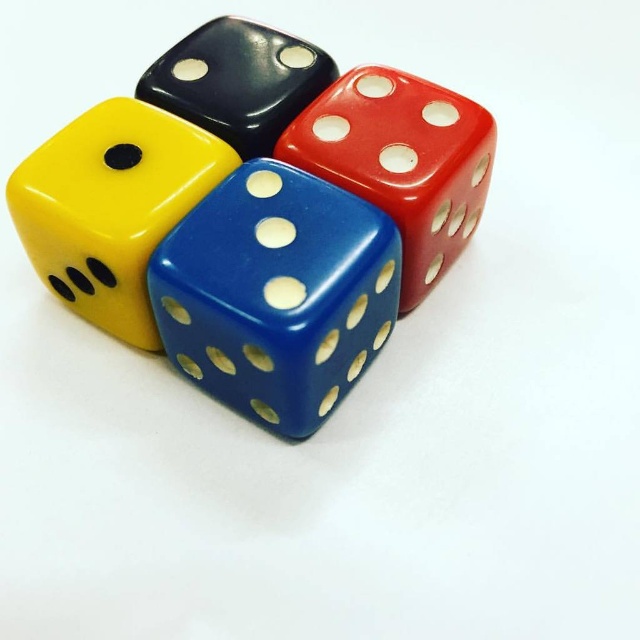
Can you confirm if red glossy dice at center is bigger than black glossy dice at upper center?

Correct, red glossy dice at center is larger in size than black glossy dice at upper center.

Which of these two, red glossy dice at center or black glossy dice at upper center, stands taller?

red glossy dice at center

Is point (449, 252) farther from viewer compared to point (209, 100)?

Yes, point (449, 252) is farther from viewer.

Find the location of a particular element. red glossy dice at center is located at coordinates (401, 161).

In the scene shown: Is yellow glossy dice at center below red glossy dice at center?

Indeed, yellow glossy dice at center is positioned under red glossy dice at center.

Between yellow glossy dice at center and red glossy dice at center, which one has more height?

red glossy dice at center is taller.

Does point (154, 147) come behind point (429, 108)?

That is False.

Identify the location of yellow glossy dice at center. (112, 208).

Which of these two, glossy plastic dice at center or yellow glossy dice at center, stands taller?

glossy plastic dice at center is taller.

Does point (205, 289) lie behind point (132, 227)?

No, (205, 289) is closer to viewer.

Does point (268, 417) come in front of point (157, 236)?

No, (268, 417) is further to viewer.

This screenshot has height=640, width=640. I want to click on glossy plastic dice at center, so click(276, 294).